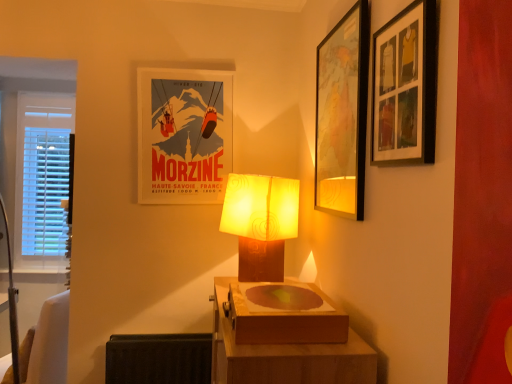
What is the approximate width of matte brown lamp at center?

12.65 inches.

What do you see at coordinates (284, 314) in the screenshot? The width and height of the screenshot is (512, 384). I see `wooden box at center` at bounding box center [284, 314].

Measure the distance between wooden picture frame at upper right, the 1th picture frame viewed from the front, and camera.

wooden picture frame at upper right, the 1th picture frame viewed from the front, is 39.03 inches from camera.

The height and width of the screenshot is (384, 512). Identify the location of white fabric swivel chair at lower left. (50, 342).

The height and width of the screenshot is (384, 512). What do you see at coordinates (50, 342) in the screenshot? I see `white fabric swivel chair at lower left` at bounding box center [50, 342].

The image size is (512, 384). Identify the location of matte paper poster at center, which appears as the 1th picture frame when viewed from the back. (184, 135).

How much space does wooden map at upper right, placed as the second picture frame when sorted from front to back, occupy horizontally?

wooden map at upper right, placed as the second picture frame when sorted from front to back, is 1.81 inches wide.

The image size is (512, 384). Describe the element at coordinates (342, 114) in the screenshot. I see `wooden map at upper right, placed as the second picture frame when sorted from front to back` at that location.

Where is `matte brown lamp at center`? The image size is (512, 384). matte brown lamp at center is located at coordinates (261, 223).

Which object is positioned more to the right, wooden table at center or wooden box at center?

wooden box at center is more to the right.

From the picture: Which of these two, wooden table at center or wooden box at center, is smaller?

Smaller between the two is wooden box at center.

Is wooden table at center situated inside wooden box at center or outside?

wooden table at center is spatially situated outside wooden box at center.

Measure the distance from wooden box at center to matte paper poster at center, the first picture frame in the left-to-right sequence.

wooden box at center is 3.51 feet away from matte paper poster at center, the first picture frame in the left-to-right sequence.

From the image's perspective, which is below, wooden box at center or matte paper poster at center, the first picture frame in the left-to-right sequence?

wooden box at center is shown below in the image.

Can you tell me how much wooden box at center and matte paper poster at center, the third picture frame in the front-to-back sequence, differ in facing direction?

90.3 degrees.

From a real-world perspective, is wooden box at center under matte paper poster at center, the first picture frame in the left-to-right sequence?

Correct, in the physical world, wooden box at center is lower than matte paper poster at center, the first picture frame in the left-to-right sequence.

Is point (236, 174) positioned behind point (307, 286)?

Yes.

What's the angular difference between matte brown lamp at center and wooden box at center's facing directions?

The facing directions of matte brown lamp at center and wooden box at center are 43 degrees apart.

Image resolution: width=512 pixels, height=384 pixels. What are the coordinates of `lamp above the wooden box at center (from the image's perspective)` in the screenshot? It's located at (261, 223).

Is matte brown lamp at center placed right next to wooden box at center?

matte brown lamp at center and wooden box at center are clearly separated.

From the image's perspective, between white fabric swivel chair at lower left and black fabric radiator at lower left, which one is located above?

white fabric swivel chair at lower left is shown above in the image.

Which of these two, white fabric swivel chair at lower left or black fabric radiator at lower left, is wider?

white fabric swivel chair at lower left is wider.

In terms of height, does white fabric swivel chair at lower left look taller or shorter compared to black fabric radiator at lower left?

Considering their sizes, white fabric swivel chair at lower left has more height than black fabric radiator at lower left.

Is the position of white fabric swivel chair at lower left more distant than that of black fabric radiator at lower left?

Yes, it is.

Considering their positions, is matte brown lamp at center located in front of or behind wooden map at upper right, placed as the second picture frame when sorted from left to right?

In the image, matte brown lamp at center appears behind wooden map at upper right, placed as the second picture frame when sorted from left to right.

In the scene shown: Can you confirm if matte brown lamp at center is bigger than wooden map at upper right, which is the 2th picture frame in back-to-front order?

Yes.

Visually, is matte brown lamp at center positioned to the left or to the right of wooden map at upper right, which is counted as the second picture frame, starting from the right?

In the image, matte brown lamp at center appears on the left side of wooden map at upper right, which is counted as the second picture frame, starting from the right.

Consider the image. Is matte brown lamp at center wider or thinner than wooden map at upper right, which is counted as the second picture frame, starting from the right?

Considering their sizes, matte brown lamp at center looks broader than wooden map at upper right, which is counted as the second picture frame, starting from the right.

Would you say matte brown lamp at center is a long distance from wooden table at center?

No, matte brown lamp at center is not far from wooden table at center.

Is matte brown lamp at center positioned with its back to wooden table at center?

No, matte brown lamp at center is not facing away from wooden table at center.

Considering the positions of objects matte brown lamp at center and wooden table at center in the image provided, who is more to the left, matte brown lamp at center or wooden table at center?

matte brown lamp at center is more to the left.

Is wooden box at center placed right next to wooden map at upper right, placed as the second picture frame when sorted from front to back?

No.

From the image's perspective, would you say wooden box at center is shown under wooden map at upper right, which is counted as the second picture frame, starting from the right?

Yes, from the image's perspective, wooden box at center is below wooden map at upper right, which is counted as the second picture frame, starting from the right.

Is wooden box at center taller than wooden map at upper right, which is the 2th picture frame in back-to-front order?

In fact, wooden box at center may be shorter than wooden map at upper right, which is the 2th picture frame in back-to-front order.

Where is `picture frame that is the 2nd object located above the wooden box at center (from the image's perspective)`? This screenshot has width=512, height=384. picture frame that is the 2nd object located above the wooden box at center (from the image's perspective) is located at coordinates (342, 114).

What are the coordinates of `box behind the wooden table at center` in the screenshot? It's located at (284, 314).

Locate an element on the screen. picture frame that appears on the left of wooden box at center is located at coordinates (184, 135).

From the image, which object appears to be nearer to wooden table at center, white fabric swivel chair at lower left or matte paper poster at center, which appears as the 1th picture frame when viewed from the back?

matte paper poster at center, which appears as the 1th picture frame when viewed from the back, lies closer to wooden table at center than the other object.

When comparing their distances from wooden picture frame at upper right, acting as the third picture frame starting from the left, does wooden table at center or wooden map at upper right, placed as the second picture frame when sorted from left to right, seem closer?

wooden map at upper right, placed as the second picture frame when sorted from left to right, is closer to wooden picture frame at upper right, acting as the third picture frame starting from the left.

Looking at the image, which one is located further to wooden picture frame at upper right, acting as the 3th picture frame starting from the back, white fabric swivel chair at lower left or matte brown lamp at center?

white fabric swivel chair at lower left is further to wooden picture frame at upper right, acting as the 3th picture frame starting from the back.

When comparing their distances from wooden picture frame at upper right, acting as the third picture frame starting from the left, does wooden box at center or wooden table at center seem further?

wooden table at center is further to wooden picture frame at upper right, acting as the third picture frame starting from the left.

Considering their positions, is wooden box at center positioned further to wooden map at upper right, placed as the second picture frame when sorted from front to back, than matte paper poster at center, the third picture frame in the front-to-back sequence?

Among the two, matte paper poster at center, the third picture frame in the front-to-back sequence, is located further to wooden map at upper right, placed as the second picture frame when sorted from front to back.

Considering their positions, is matte paper poster at center, the first picture frame in the left-to-right sequence, positioned closer to wooden box at center than black fabric radiator at lower left?

black fabric radiator at lower left.

Which object lies nearer to the anchor point matte brown lamp at center, wooden picture frame at upper right, which appears as the 1th picture frame when viewed from the right, or matte paper poster at center, which appears as the 1th picture frame when viewed from the back?

matte paper poster at center, which appears as the 1th picture frame when viewed from the back, is positioned closer to the anchor matte brown lamp at center.

Considering their positions, is wooden box at center positioned further to wooden picture frame at upper right, acting as the third picture frame starting from the left, than wooden map at upper right, placed as the second picture frame when sorted from left to right?

Among the two, wooden box at center is located further to wooden picture frame at upper right, acting as the third picture frame starting from the left.

Locate an element on the screen. The image size is (512, 384). swivel chair that lies between matte paper poster at center, arranged as the third picture frame when viewed from the right, and black fabric radiator at lower left from top to bottom is located at coordinates (50, 342).

I want to click on lamp between wooden picture frame at upper right, which appears as the 1th picture frame when viewed from the right, and matte paper poster at center, which appears as the 1th picture frame when viewed from the back, from front to back, so click(x=261, y=223).

Locate an element on the screen. table situated between white fabric swivel chair at lower left and wooden box at center from left to right is located at coordinates coord(285,356).

I want to click on radiator located between white fabric swivel chair at lower left and matte brown lamp at center in the left-right direction, so click(x=159, y=359).